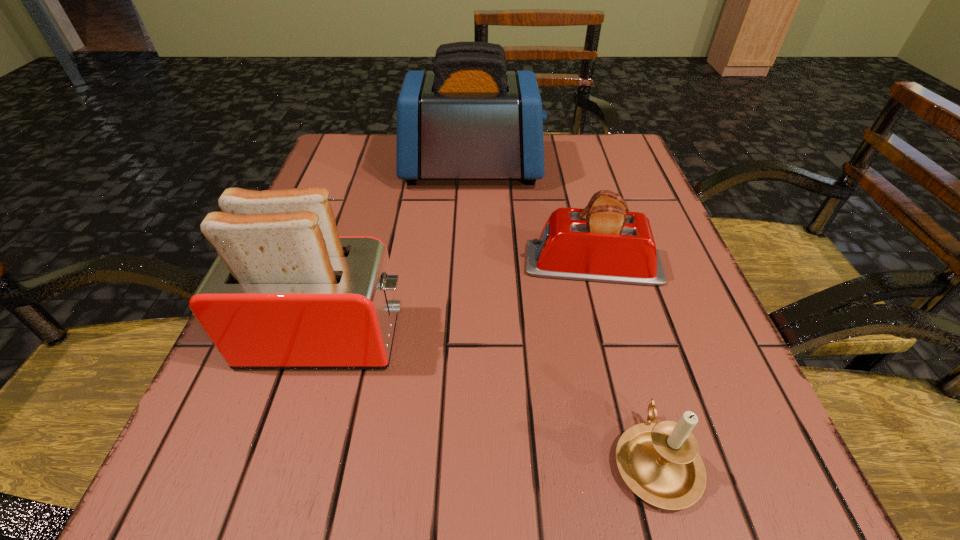
This screenshot has width=960, height=540. I want to click on free space located with a handle on the side of the candle holder, so click(601, 266).

Image resolution: width=960 pixels, height=540 pixels. I want to click on object present at the far edge, so click(x=469, y=118).

You are a GUI agent. You are given a task and a screenshot of the screen. Output one action in this format:
    pyautogui.click(x=<x>, y=<y>)
    Task: Click on the object that is at the near edge
    The image size is (960, 540).
    Given the screenshot: What is the action you would take?
    pyautogui.click(x=660, y=463)

What are the coordinates of `object that is at the left edge` in the screenshot? It's located at click(285, 291).

Where is `toaster located in the right edge section of the desktop`? The height and width of the screenshot is (540, 960). toaster located in the right edge section of the desktop is located at coordinates (603, 242).

The height and width of the screenshot is (540, 960). What are the coordinates of `candle holder that is at the right edge` in the screenshot? It's located at (660, 463).

You are a GUI agent. You are given a task and a screenshot of the screen. Output one action in this format:
    pyautogui.click(x=<x>, y=<y>)
    Task: Click on the object that is positioned at the near right corner
    The width and height of the screenshot is (960, 540).
    Given the screenshot: What is the action you would take?
    pyautogui.click(x=660, y=463)

Image resolution: width=960 pixels, height=540 pixels. Find the location of `vacant region at the far edge of the desktop`. vacant region at the far edge of the desktop is located at coordinates (482, 179).

Image resolution: width=960 pixels, height=540 pixels. Find the location of `vacant space at the near edge of the desktop`. vacant space at the near edge of the desktop is located at coordinates (408, 474).

In order to click on vacant space at the right edge of the desktop in this screenshot , I will do `click(674, 374)`.